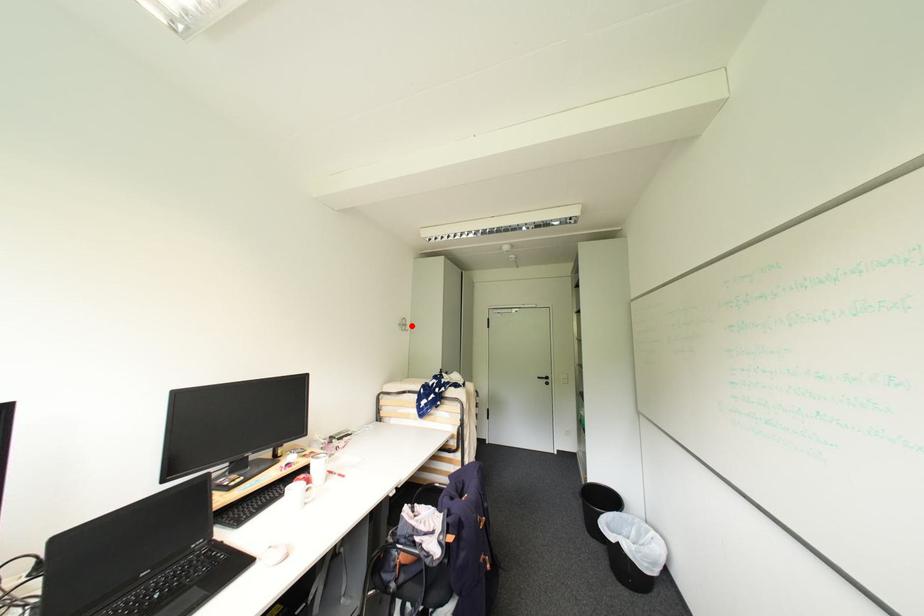
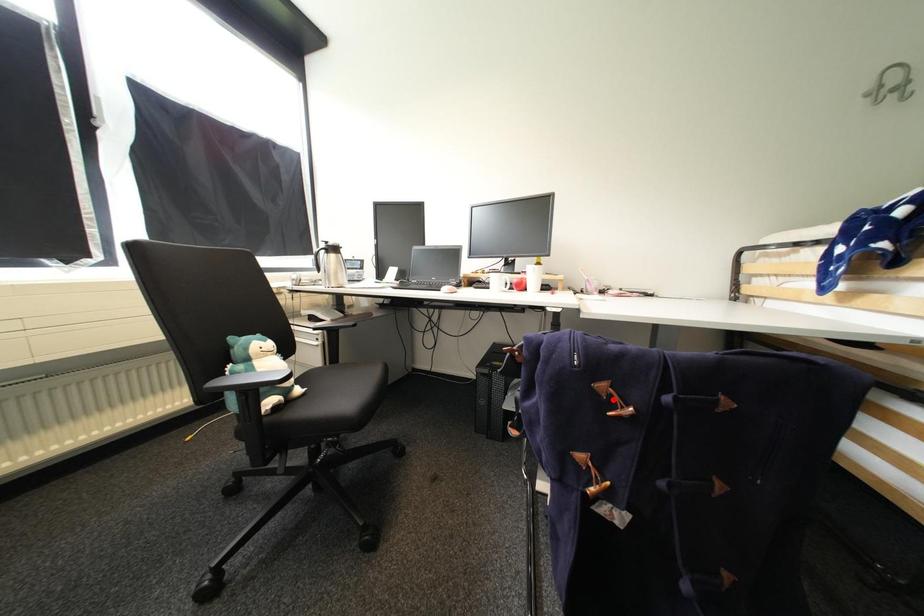
I am providing you with two images of the same scene from different viewpoints. A red point is marked on the first image and another point is marked on the second image. Is the red point in image1 aligned with the point shown in image2?

No